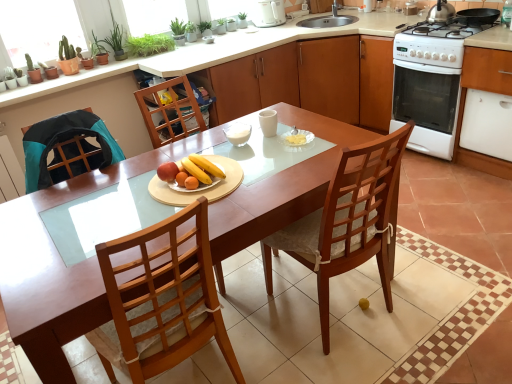
Identify the location of free point in front of wooden chair at center. tap(372, 362).